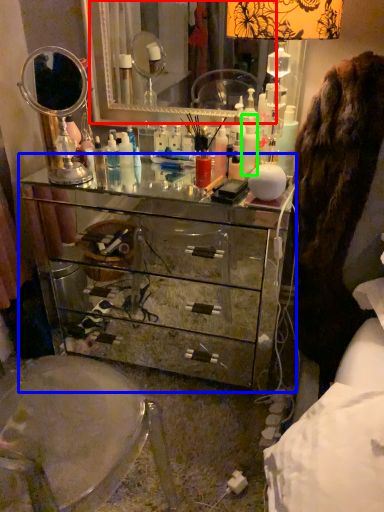
Question: Considering the real-world distances, which object is farthest from mirror (highlighted by a red box)? chest of drawers (highlighted by a blue box) or toiletry (highlighted by a green box)?

Choices:
 (A) chest of drawers
 (B) toiletry

Answer: (B)